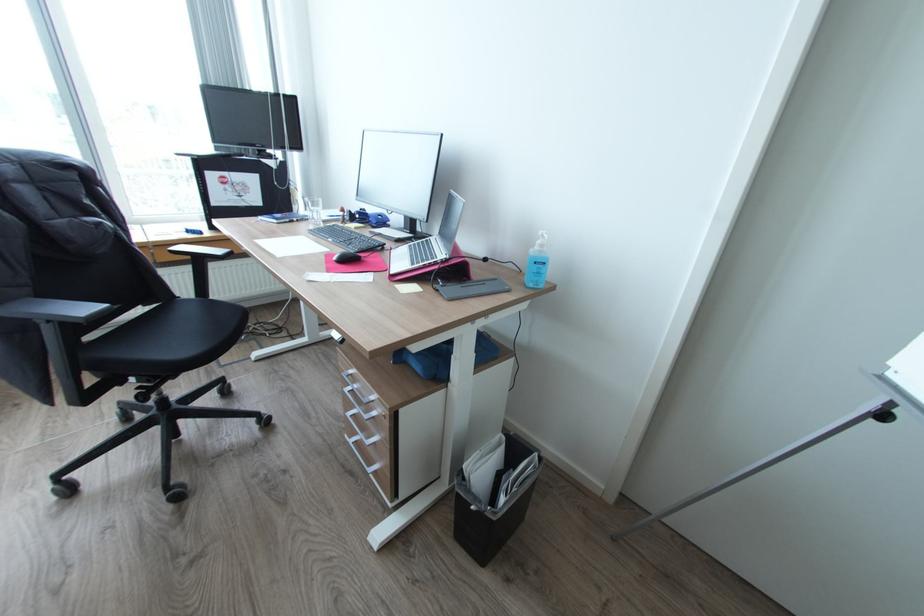
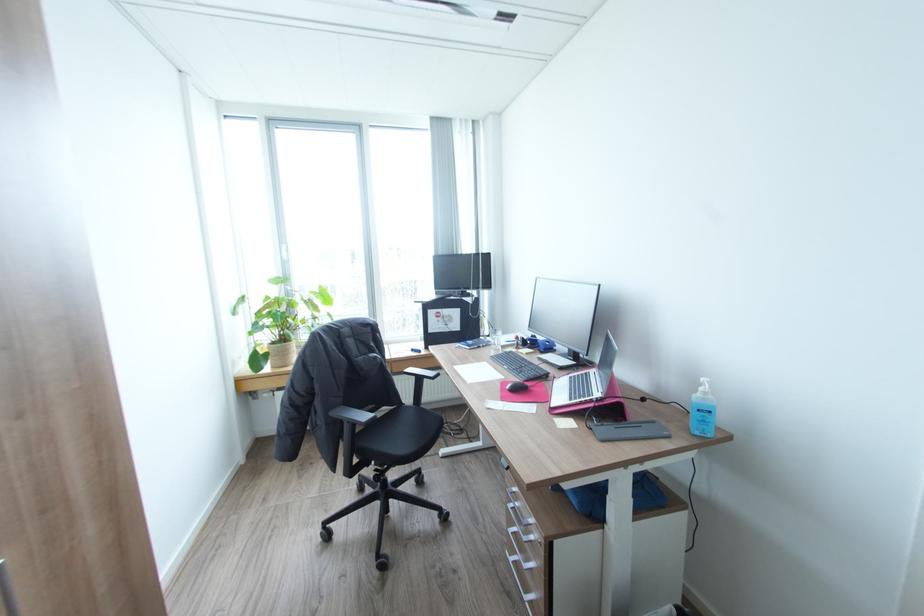
Find the pixel in the second image that matches point 334,270 in the first image.

(507, 399)